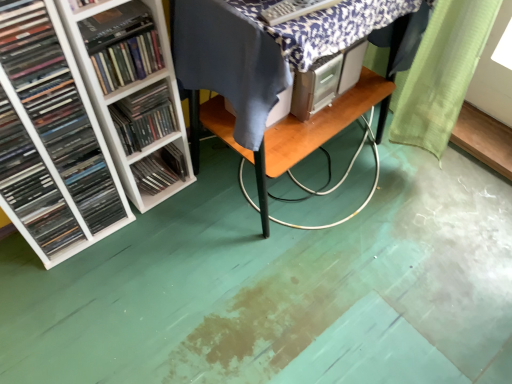
Question: Does wooden table at center come in front of white plastic shelf at left, the third book when ordered from left to right?

Choices:
 (A) yes
 (B) no

Answer: (B)

Question: Can you confirm if wooden table at center is bigger than white plastic shelf at left, marked as the 1th book in a right-to-left arrangement?

Choices:
 (A) yes
 (B) no

Answer: (A)

Question: Can you confirm if wooden table at center is wider than white plastic shelf at left, the third book when ordered from left to right?

Choices:
 (A) no
 (B) yes

Answer: (B)

Question: Is wooden table at center placed right next to white plastic shelf at left, marked as the 1th book in a right-to-left arrangement?

Choices:
 (A) yes
 (B) no

Answer: (B)

Question: Is wooden table at center looking in the opposite direction of white plastic shelf at left, marked as the 1th book in a right-to-left arrangement?

Choices:
 (A) yes
 (B) no

Answer: (B)

Question: Considering the positions of white plastic shelf at left, marked as the 1th book in a right-to-left arrangement, and white plastic shelves at left, which is the 2th book in right-to-left order, in the image, is white plastic shelf at left, marked as the 1th book in a right-to-left arrangement, bigger or smaller than white plastic shelves at left, which is the 2th book in right-to-left order,?

Choices:
 (A) big
 (B) small

Answer: (B)

Question: Visually, is white plastic shelf at left, the third book when ordered from left to right, positioned to the left or to the right of white plastic shelves at left, which is counted as the second book, starting from the left?

Choices:
 (A) right
 (B) left

Answer: (A)

Question: From the image's perspective, relative to white plastic shelves at left, which is the 2th book in right-to-left order, is white plastic shelf at left, the third book when ordered from left to right, above or below?

Choices:
 (A) below
 (B) above

Answer: (B)

Question: In terms of height, does white plastic shelf at left, marked as the 1th book in a right-to-left arrangement, look taller or shorter compared to white plastic shelves at left, which is counted as the second book, starting from the left?

Choices:
 (A) tall
 (B) short

Answer: (B)

Question: Is point (134, 29) closer or farther from the camera than point (40, 162)?

Choices:
 (A) closer
 (B) farther

Answer: (A)

Question: Would you say hardcover book at left is to the left or to the right of matte black books at left, which ranks as the 3th book in right-to-left order, in the picture?

Choices:
 (A) left
 (B) right

Answer: (B)

Question: Considering their positions, is hardcover book at left located in front of or behind matte black books at left, which ranks as the 3th book in right-to-left order?

Choices:
 (A) front
 (B) behind

Answer: (B)

Question: From a real-world perspective, relative to matte black books at left, positioned as the 1th book in left-to-right order, is hardcover book at left vertically above or below?

Choices:
 (A) below
 (B) above

Answer: (B)

Question: From the image's perspective, is white plastic shelf at left, the third book when ordered from left to right, above or below white plastic shelf at left, marked as the second shelf in a front-to-back arrangement?

Choices:
 (A) above
 (B) below

Answer: (A)

Question: Is white plastic shelf at left, marked as the 1th book in a right-to-left arrangement, wider or thinner than white plastic shelf at left, marked as the second shelf in a front-to-back arrangement?

Choices:
 (A) wide
 (B) thin

Answer: (A)